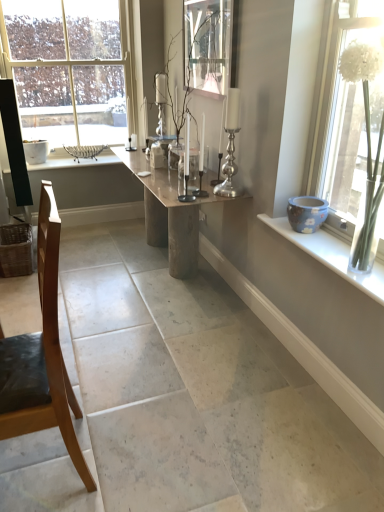
You are a GUI agent. You are given a task and a screenshot of the screen. Output one action in this format:
    pyautogui.click(x=<x>, y=<y>)
    Task: Click on the free location in front of natural wood table at center
    The width and height of the screenshot is (384, 512).
    Given the screenshot: What is the action you would take?
    pyautogui.click(x=143, y=335)